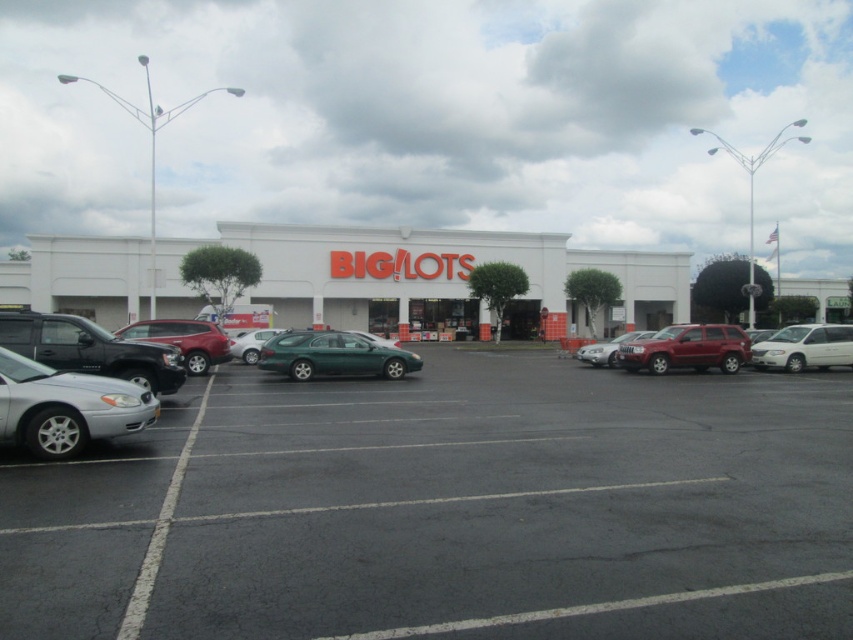
Question: Is black asphalt parking lot at center closer to camera compared to green matte station wagon at center?

Choices:
 (A) yes
 (B) no

Answer: (A)

Question: Estimate the real-world distances between objects in this image. Which object is closer to the shiny black suv at left?

Choices:
 (A) white matte van at right
 (B) black asphalt parking lot at center
 (C) white matte big lots at center

Answer: (B)

Question: Which of the following is the closest to the observer?

Choices:
 (A) (4, 637)
 (B) (312, 337)
 (C) (482, 257)
 (D) (614, 356)

Answer: (A)

Question: Can you confirm if shiny black suv at left is positioned to the left of white matte van at right?

Choices:
 (A) yes
 (B) no

Answer: (A)

Question: Does white matte big lots at center have a smaller size compared to satin red suv at left?

Choices:
 (A) yes
 (B) no

Answer: (B)

Question: Which point is farther to the camera?

Choices:
 (A) (409, 285)
 (B) (386, 365)
 (C) (244, 332)
 (D) (143, 380)

Answer: (A)